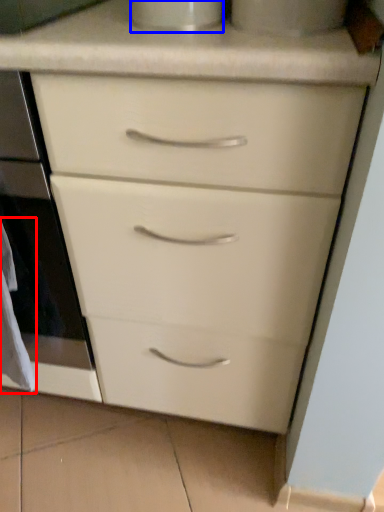
Question: Which object is closer to the camera taking this photo, material (highlighted by a red box) or appliance (highlighted by a blue box)?

Choices:
 (A) material
 (B) appliance

Answer: (B)